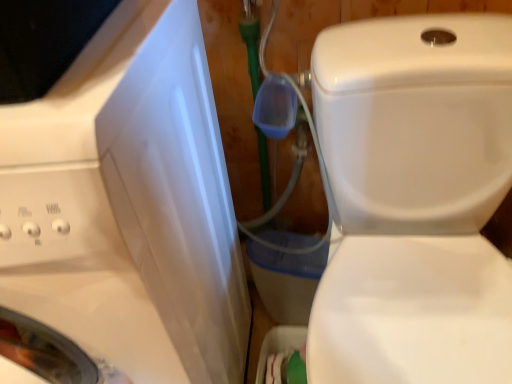
In order to face white glossy washing machine at left, should I rotate leftwards or rightwards?

A 26.878 degree turn to the left will do.

The image size is (512, 384). I want to click on white glossy washing machine at left, so click(128, 205).

This screenshot has width=512, height=384. What do you see at coordinates (128, 205) in the screenshot?
I see `white glossy washing machine at left` at bounding box center [128, 205].

The height and width of the screenshot is (384, 512). Describe the element at coordinates (414, 200) in the screenshot. I see `white glossy toilet at center` at that location.

Find the location of a particular element. This screenshot has width=512, height=384. white glossy toilet at center is located at coordinates (414, 200).

You are a GUI agent. You are given a task and a screenshot of the screen. Output one action in this format:
    pyautogui.click(x=<x>, y=<y>)
    Task: Click on the white glossy washing machine at left
    
    Given the screenshot: What is the action you would take?
    pyautogui.click(x=128, y=205)

Consider the image. Which is more to the left, white glossy washing machine at left or white glossy toilet at center?

Positioned to the left is white glossy washing machine at left.

Relative to white glossy toilet at center, is white glossy washing machine at left in front or behind?

Clearly, white glossy washing machine at left is in front of white glossy toilet at center.

Considering the points (213, 100) and (507, 95), which point is behind, point (213, 100) or point (507, 95)?

The point (213, 100) is farther.

From the image's perspective, is white glossy washing machine at left located above white glossy toilet at center?

Yes.

From a real-world perspective, is white glossy washing machine at left over white glossy toilet at center?

Yes, from a real-world perspective, white glossy washing machine at left is above white glossy toilet at center.

Consider the image. Between white glossy washing machine at left and white glossy toilet at center, which one has larger width?

With larger width is white glossy toilet at center.

From their relative heights in the image, would you say white glossy washing machine at left is taller or shorter than white glossy toilet at center?

Clearly, white glossy washing machine at left is taller compared to white glossy toilet at center.

Does white glossy washing machine at left have a larger size compared to white glossy toilet at center?

Yes.

Is white glossy toilet at center inside white glossy washing machine at left?

Definitely not — white glossy toilet at center is not inside white glossy washing machine at left.

Are white glossy washing machine at left and white glossy toilet at center far apart?

No, there isn't a large distance between white glossy washing machine at left and white glossy toilet at center.

Is white glossy washing machine at left facing away from white glossy toilet at center?

No, white glossy toilet at center is not at the back of white glossy washing machine at left.

How many degrees apart are the facing directions of white glossy washing machine at left and white glossy toilet at center?

The angular difference between white glossy washing machine at left and white glossy toilet at center is 3.49 degrees.

Find the location of `washing machine above the white glossy toilet at center (from a real-world perspective)`. washing machine above the white glossy toilet at center (from a real-world perspective) is located at coordinates (128, 205).

Does white glossy toilet at center appear on the left side of white glossy washing machine at left?

No.

Is white glossy toilet at center further to the viewer compared to white glossy washing machine at left?

Yes, white glossy toilet at center is further from the camera.

Is point (505, 46) farther from camera compared to point (53, 202)?

Yes, point (505, 46) is farther from viewer.

From the image's perspective, which one is positioned higher, white glossy toilet at center or white glossy washing machine at left?

From the image's view, white glossy washing machine at left is above.

From a real-world perspective, is white glossy toilet at center on top of white glossy washing machine at left?

Result: No, from a real-world perspective, white glossy toilet at center is not on top of white glossy washing machine at left.

Looking at this image, considering the relative sizes of white glossy toilet at center and white glossy washing machine at left in the image provided, is white glossy toilet at center wider than white glossy washing machine at left?

Yes.

From the picture: Is white glossy toilet at center shorter than white glossy washing machine at left?

Yes, white glossy toilet at center is shorter than white glossy washing machine at left.

Can you confirm if white glossy toilet at center is smaller than white glossy washing machine at left?

Correct, white glossy toilet at center occupies less space than white glossy washing machine at left.

Based on the photo, is white glossy washing machine at left a part of white glossy toilet at center?

No, white glossy washing machine at left is not a part of white glossy toilet at center.

Would you say white glossy toilet at center is a long distance from white glossy washing machine at left?

No, white glossy toilet at center is not far away from white glossy washing machine at left.

Could you tell me if white glossy toilet at center is facing white glossy washing machine at left?

No, white glossy toilet at center does not turn towards white glossy washing machine at left.

How many degrees apart are the facing directions of white glossy toilet at center and white glossy washing machine at left?

They differ by 3.49 degrees in their facing directions.

The width and height of the screenshot is (512, 384). Identify the location of toilet below the white glossy washing machine at left (from the image's perspective). (414, 200).

Where is `toilet that appears below the white glossy washing machine at left (from a real-world perspective)`? The width and height of the screenshot is (512, 384). toilet that appears below the white glossy washing machine at left (from a real-world perspective) is located at coordinates (414, 200).

What are the coordinates of `toilet below the white glossy washing machine at left (from the image's perspective)` in the screenshot? It's located at (414, 200).